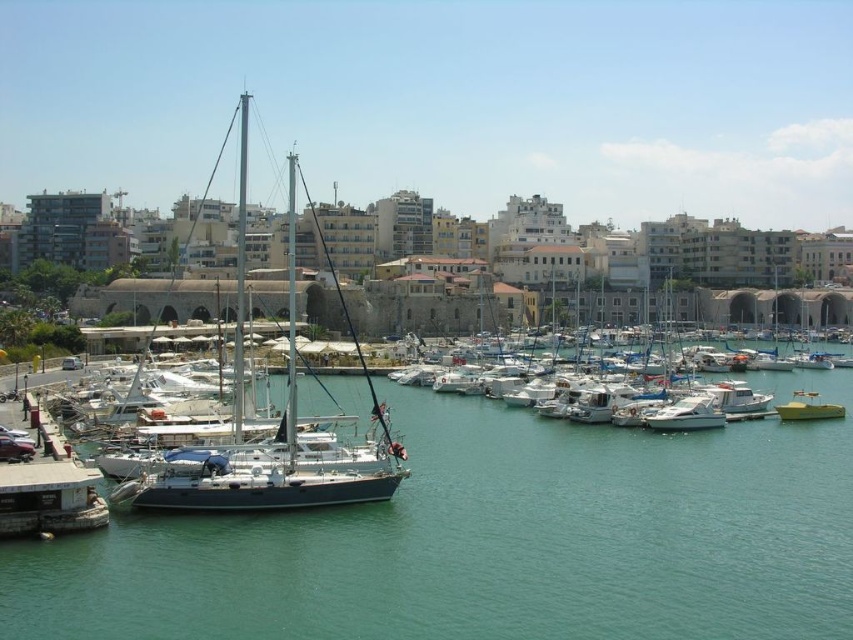
You are a photographer positioned at the edge of the marina, aiming to capture both the white glossy boat at center and the green matte boat at center in your shot. Based on their positions, which boat will appear closer to the camera in the photograph?

The white glossy boat at center will appear closer to the camera because it is positioned in front of the green matte boat at center.

You are standing at the point marked by coordinates point (492, 540) in the marina scene. What do you see directly below you?

The point (492, 540) marks teal water at center, so directly below you is the teal water at center.